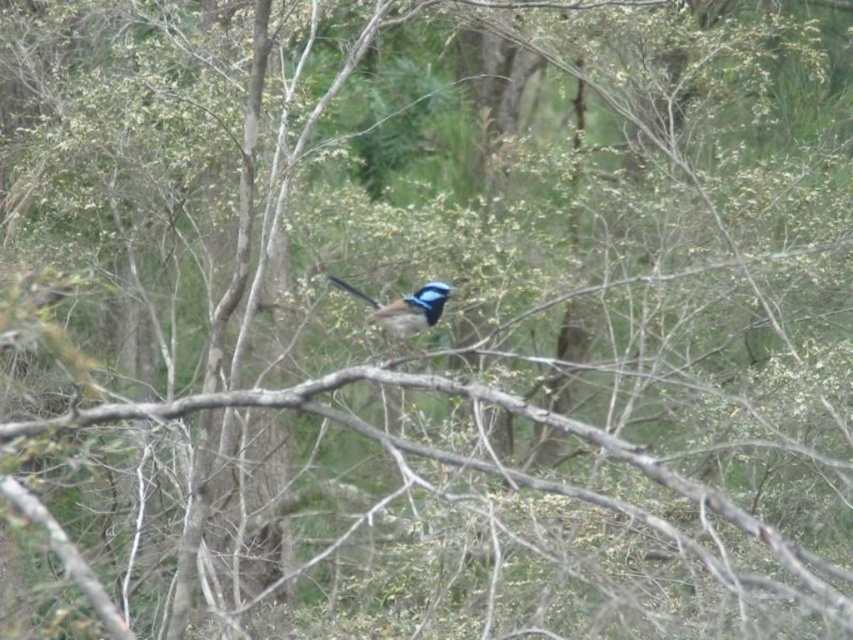
Measure the distance between point (225, 403) and camera.

The distance of point (225, 403) from camera is 6.74 meters.

Is brown wood at center positioned at the back of blue glossy bird at center?

No, it is in front of blue glossy bird at center.

At what (x,y) coordinates should I click in order to perform the action: click on brown wood at center. Please return your answer as a coordinate pair (x, y). Looking at the image, I should click on (473, 400).